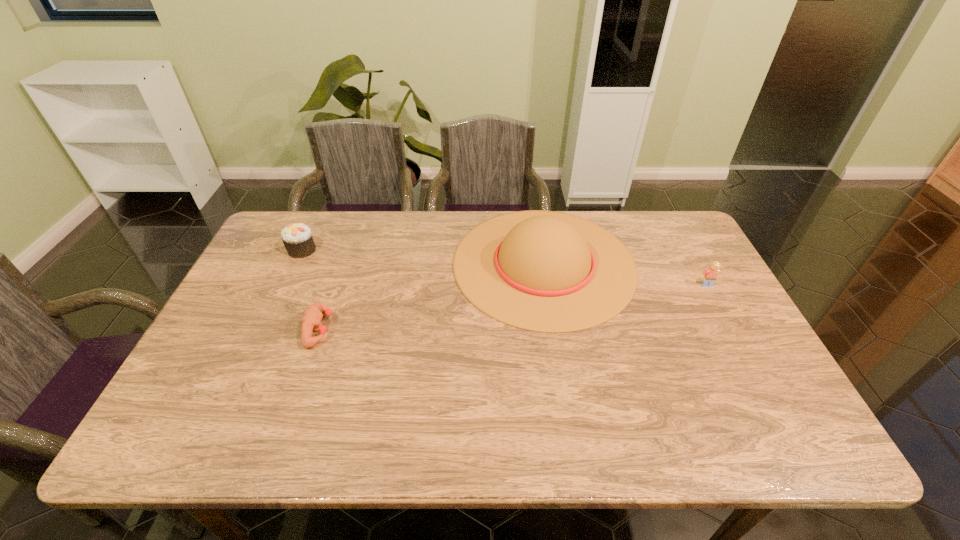
Where is `vacant space at the near right corner of the desktop`? vacant space at the near right corner of the desktop is located at coordinates (751, 441).

This screenshot has width=960, height=540. I want to click on vacant space that is in between the tallest object and the shortest object, so click(432, 296).

What are the coordinates of `vacant area that lies between the sombrero and the second object from left to right` in the screenshot? It's located at (432, 296).

You are a GUI agent. You are given a task and a screenshot of the screen. Output one action in this format:
    pyautogui.click(x=<x>, y=<y>)
    Task: Click on the free space that is in between the cupcake and the third object from right to left
    
    Given the screenshot: What is the action you would take?
    pyautogui.click(x=311, y=289)

You are a GUI agent. You are given a task and a screenshot of the screen. Output one action in this format:
    pyautogui.click(x=<x>, y=<y>)
    Task: Click on the free space between the puncher and the leftmost object
    
    Given the screenshot: What is the action you would take?
    pyautogui.click(x=311, y=289)

The height and width of the screenshot is (540, 960). In order to click on object that is the second closest to the third object from right to left in this screenshot , I will do `click(544, 271)`.

Identify the location of object identified as the third closest to the second object from right to left. (297, 238).

At what (x,y) coordinates should I click in order to perform the action: click on vacant space that satisfies the following two spatial constraints: 1. on the front-facing side of the rightmost object; 2. with the gloves of the shortest object facing forward. Please return your answer as a coordinate pair (x, y). Looking at the image, I should click on (731, 329).